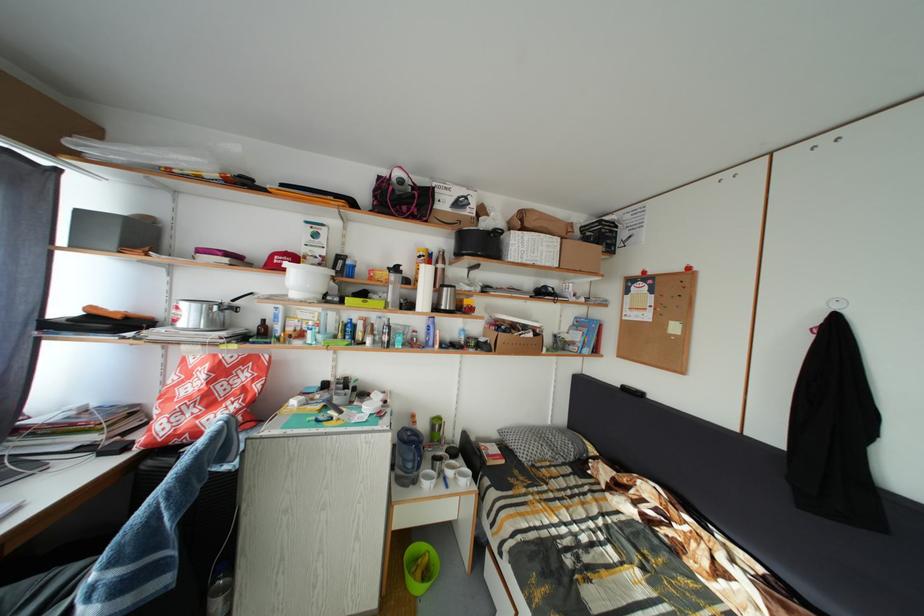
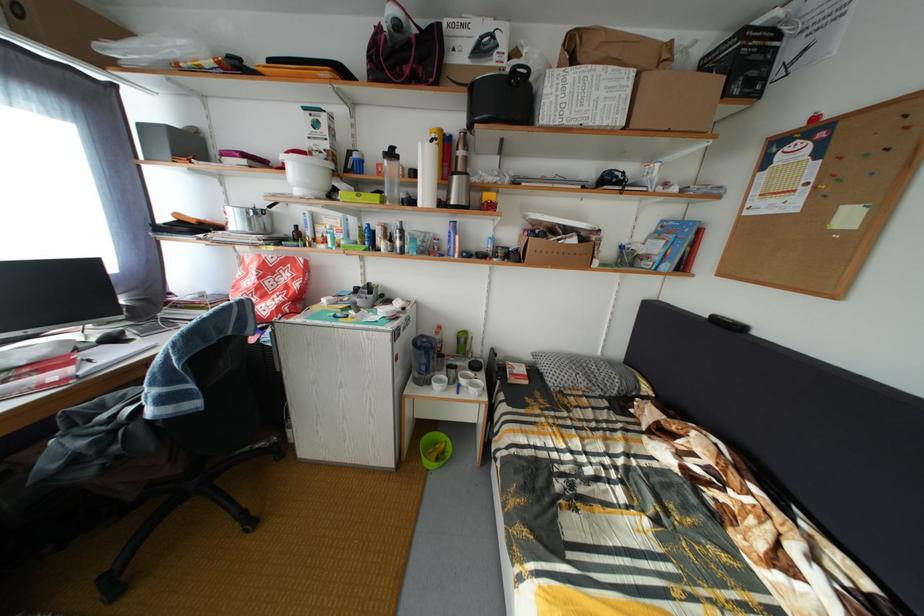
Locate, in the second image, the point that corresponds to pixel 454 485 in the first image.

(468, 392)